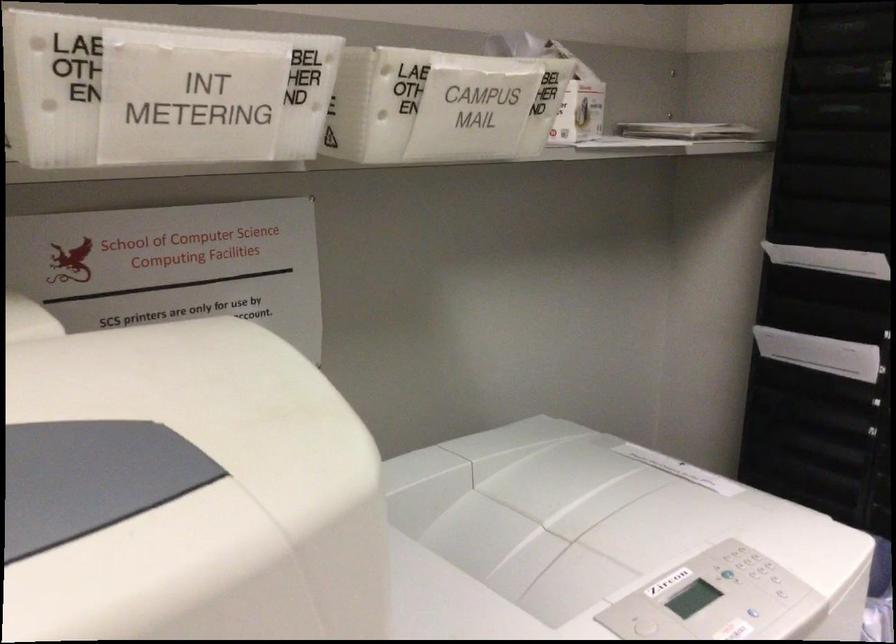
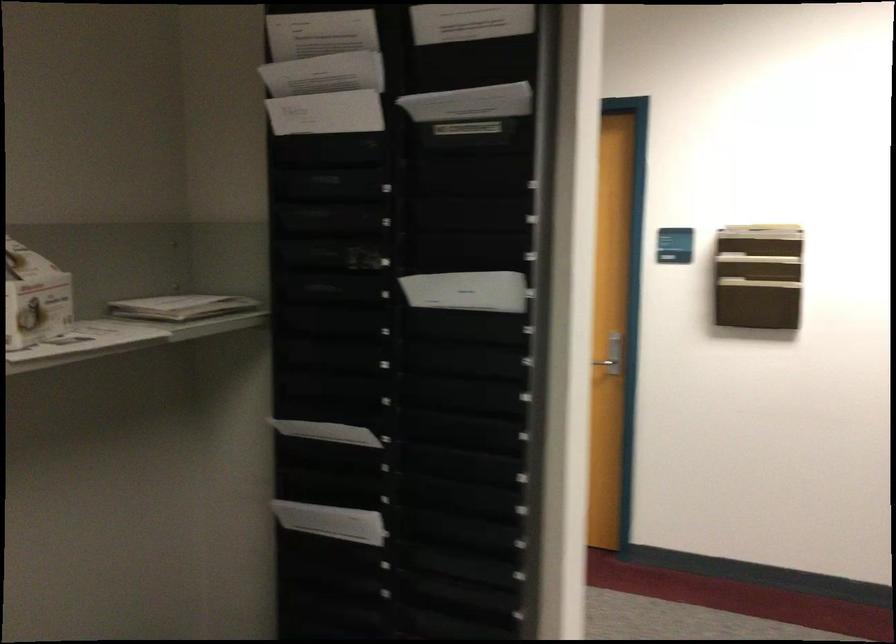
Question: The camera is either moving clockwise (left) or counter-clockwise (right) around the object. The first image is from the beginning of the video and the second image is from the end. Is the camera moving left or right when shooting the video?

Choices:
 (A) Left
 (B) Right

Answer: (A)